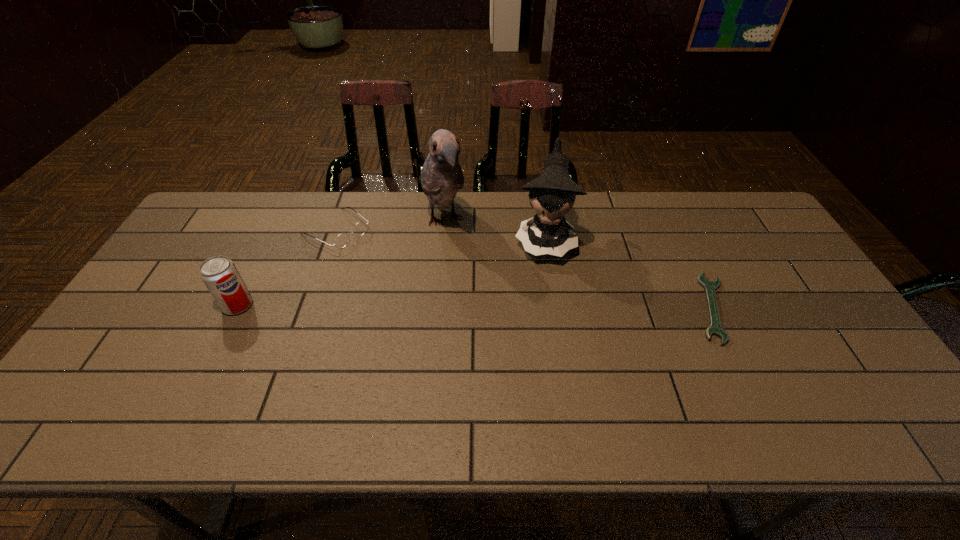
Identify the location of empty space that is in between the second object from left to right and the fourth shortest object. (441, 234).

Find the location of a particular element. This screenshot has height=540, width=960. vacant region between the wrench and the third object from right to left is located at coordinates (578, 264).

You are a GUI agent. You are given a task and a screenshot of the screen. Output one action in this format:
    pyautogui.click(x=<x>, y=<y>)
    Task: Click on the unoccupied position between the fourth object from left to right and the second object from left to right
    The height and width of the screenshot is (540, 960).
    Given the screenshot: What is the action you would take?
    pyautogui.click(x=441, y=234)

Locate an element on the screen. blank region between the leftmost object and the rightmost object is located at coordinates (475, 307).

The height and width of the screenshot is (540, 960). What are the coordinates of `free spot between the wrench and the tallest object` in the screenshot? It's located at (578, 264).

Find the location of `unoccupied area between the parrot and the third shortest object`. unoccupied area between the parrot and the third shortest object is located at coordinates (341, 263).

Find the location of `empty location between the fourth object from right to left and the parrot`. empty location between the fourth object from right to left and the parrot is located at coordinates (391, 225).

Find the location of a particular element. This screenshot has width=960, height=540. free space between the spectacles and the fourth shortest object is located at coordinates (441, 234).

Where is `free space between the fourth tallest object and the third shortest object`? This screenshot has height=540, width=960. free space between the fourth tallest object and the third shortest object is located at coordinates (287, 267).

This screenshot has height=540, width=960. In order to click on free spot between the doll and the spectacles in this screenshot , I will do `click(441, 234)`.